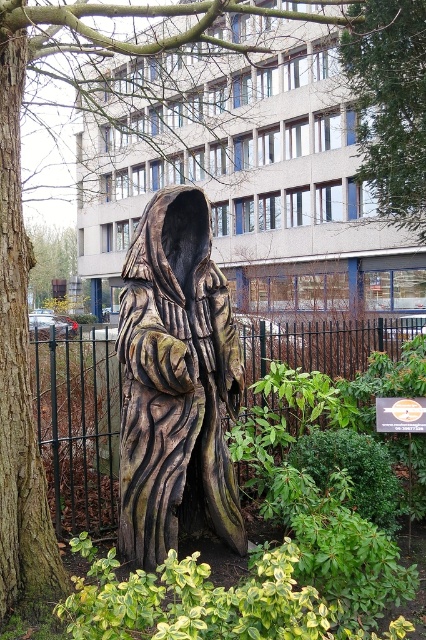
In the scene shown: You are standing at the center of a park and see a wooden statue at center. Can you tell me what is located at the coordinates point (175, 381)?

The wooden statue at center is located at point (175, 381).

You are a painter standing at the base of the wooden statue at center, and you want to capture the black metal fence at center in your painting. Can you see the entire fence from your current position?

The wooden statue at center is located below the black metal fence at center, so yes, you can see the entire fence above the statue.